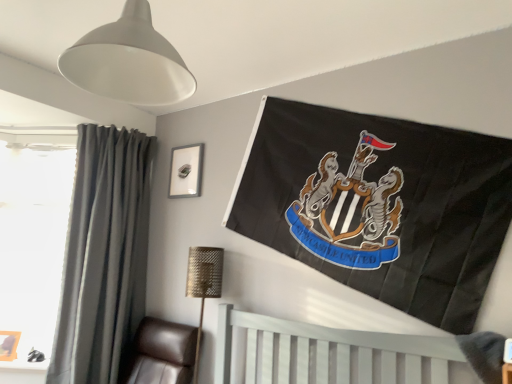
Question: Should I look upward or downward to see dark gray fabric curtain at left?

Choices:
 (A) down
 (B) up

Answer: (A)

Question: From the image's perspective, is wooden picture frame at lower left, marked as the first picture frame in a front-to-back arrangement, on metallic silver picture frame at upper center, which is counted as the second picture frame, starting from the bottom?

Choices:
 (A) yes
 (B) no

Answer: (B)

Question: Considering the relative sizes of wooden picture frame at lower left, positioned as the 1th picture frame in bottom-to-top order, and metallic silver picture frame at upper center, arranged as the 1th picture frame when viewed from the top, in the image provided, is wooden picture frame at lower left, positioned as the 1th picture frame in bottom-to-top order, shorter than metallic silver picture frame at upper center, arranged as the 1th picture frame when viewed from the top,?

Choices:
 (A) yes
 (B) no

Answer: (A)

Question: Is wooden picture frame at lower left, the second picture frame positioned from the top, positioned beyond the bounds of metallic silver picture frame at upper center, which appears as the first picture frame when viewed from the back?

Choices:
 (A) no
 (B) yes

Answer: (B)

Question: Is wooden picture frame at lower left, which ranks as the second picture frame in right-to-left order, facing away from metallic silver picture frame at upper center, arranged as the 1th picture frame when viewed from the top?

Choices:
 (A) yes
 (B) no

Answer: (B)

Question: Is wooden picture frame at lower left, marked as the first picture frame in a front-to-back arrangement, thinner than metallic silver picture frame at upper center, positioned as the second picture frame in left-to-right order?

Choices:
 (A) no
 (B) yes

Answer: (A)

Question: Is wooden picture frame at lower left, marked as the 2th picture frame in a back-to-front arrangement, taller than metallic silver picture frame at upper center, which is counted as the second picture frame, starting from the bottom?

Choices:
 (A) yes
 (B) no

Answer: (B)

Question: From a real-world perspective, is metallic silver picture frame at upper center, which is counted as the second picture frame, starting from the bottom, beneath white matte lampshade at upper left, which ranks as the second lamp in bottom-to-top order?

Choices:
 (A) no
 (B) yes

Answer: (B)

Question: Does metallic silver picture frame at upper center, which is the second picture frame in front-to-back order, have a lesser height compared to white matte lampshade at upper left, the 1th lamp viewed from the front?

Choices:
 (A) no
 (B) yes

Answer: (B)

Question: From a real-world perspective, is metallic silver picture frame at upper center, positioned as the second picture frame in left-to-right order, over white matte lampshade at upper left, the 1th lamp viewed from the front?

Choices:
 (A) yes
 (B) no

Answer: (B)

Question: Are metallic silver picture frame at upper center, acting as the first picture frame starting from the right, and white matte lampshade at upper left, which is the first lamp in top-to-bottom order, making contact?

Choices:
 (A) no
 (B) yes

Answer: (A)

Question: Is metallic silver picture frame at upper center, which is the second picture frame in front-to-back order, further to camera compared to white matte lampshade at upper left, which ranks as the second lamp in bottom-to-top order?

Choices:
 (A) yes
 (B) no

Answer: (A)

Question: From the image's perspective, is metallic silver picture frame at upper center, which is the second picture frame in front-to-back order, beneath white matte lampshade at upper left, which ranks as the second lamp in bottom-to-top order?

Choices:
 (A) yes
 (B) no

Answer: (A)

Question: Can you confirm if transparent glass window at left is shorter than gold textured lamp at lower center, which is the second lamp in top-to-bottom order?

Choices:
 (A) no
 (B) yes

Answer: (A)